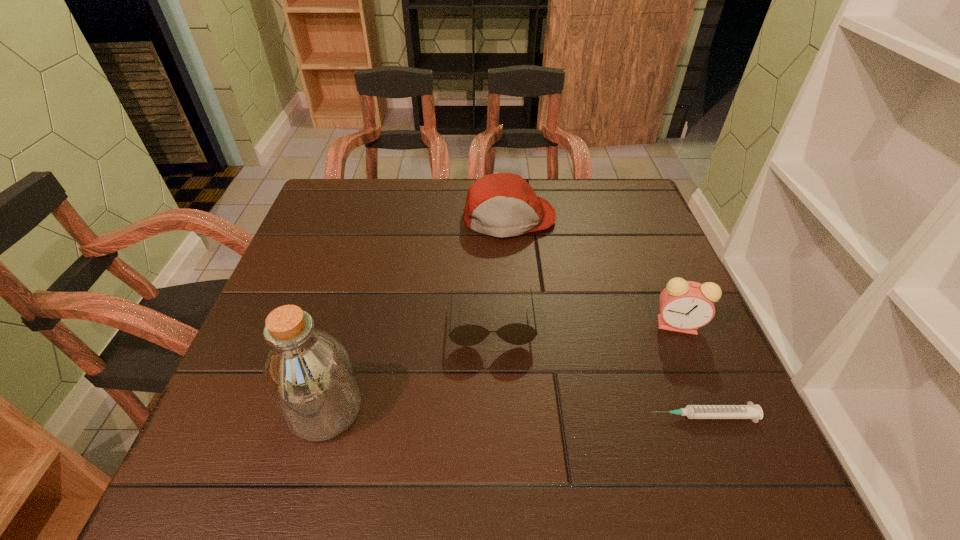
Locate an element on the screen. blank space located on the face of the alarm clock is located at coordinates (588, 387).

This screenshot has width=960, height=540. What are the coordinates of `free space located on the face of the alarm clock` in the screenshot? It's located at (582, 392).

Where is `blank space located on the face of the alarm clock`? The height and width of the screenshot is (540, 960). blank space located on the face of the alarm clock is located at coordinates (582, 392).

Identify the location of vacant space located 0.110m on the front-facing side of the farthest object. This screenshot has width=960, height=540. (517, 270).

Where is `free space located 0.320m on the front-facing side of the farthest object`? This screenshot has height=540, width=960. free space located 0.320m on the front-facing side of the farthest object is located at coordinates (528, 339).

You are a GUI agent. You are given a task and a screenshot of the screen. Output one action in this format:
    pyautogui.click(x=<x>, y=<y>)
    Task: Click on the vacant region located 0.300m on the front-facing side of the farthest object
    
    Given the screenshot: What is the action you would take?
    pyautogui.click(x=527, y=331)

You are a GUI agent. You are given a task and a screenshot of the screen. Output one action in this format:
    pyautogui.click(x=<x>, y=<y>)
    Task: Click on the free space located on the front-facing side of the fourth tallest object
    The width and height of the screenshot is (960, 540).
    Given the screenshot: What is the action you would take?
    pyautogui.click(x=493, y=381)

Where is `free point located on the front-facing side of the fourth tallest object`? Image resolution: width=960 pixels, height=540 pixels. free point located on the front-facing side of the fourth tallest object is located at coordinates (494, 399).

Identify the location of free region located 0.180m on the front-facing side of the fourth tallest object. (495, 429).

Find the location of a particular element. The width and height of the screenshot is (960, 540). object at the far edge is located at coordinates (501, 205).